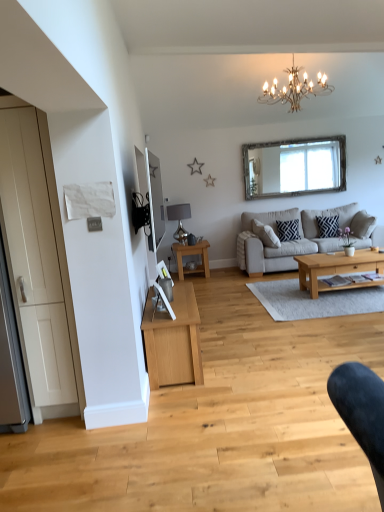
Question: Is there a large distance between matte black mirror at upper left, the first mirror positioned from the left, and silver-framed mirror at upper center, which appears as the second mirror when viewed from the front?

Choices:
 (A) no
 (B) yes

Answer: (B)

Question: Is matte black mirror at upper left, acting as the 2th mirror starting from the right, wider than silver-framed mirror at upper center, positioned as the 1th mirror in top-to-bottom order?

Choices:
 (A) yes
 (B) no

Answer: (B)

Question: Is silver-framed mirror at upper center, marked as the 1th mirror in a back-to-front arrangement, located within matte black mirror at upper left, the 1th mirror ordered from the bottom?

Choices:
 (A) yes
 (B) no

Answer: (B)

Question: From a real-world perspective, is matte black mirror at upper left, the 1th mirror ordered from the bottom, located beneath silver-framed mirror at upper center, the 2th mirror when ordered from bottom to top?

Choices:
 (A) no
 (B) yes

Answer: (B)

Question: Does matte black mirror at upper left, which is the 2th mirror from top to bottom, have a smaller size compared to silver-framed mirror at upper center, the first mirror positioned from the right?

Choices:
 (A) no
 (B) yes

Answer: (B)

Question: Can you confirm if matte black mirror at upper left, which is the 2th mirror in back-to-front order, is thinner than silver-framed mirror at upper center, the first mirror positioned from the right?

Choices:
 (A) no
 (B) yes

Answer: (B)

Question: Is light wood/texture coffee table at center, the 2th coffee table in the right-to-left sequence, to the right of light gray fabric couch at center from the viewer's perspective?

Choices:
 (A) yes
 (B) no

Answer: (B)

Question: Is the surface of light wood/texture coffee table at center, the 2th coffee table when ordered from front to back, in direct contact with light gray fabric couch at center?

Choices:
 (A) yes
 (B) no

Answer: (B)

Question: Is light wood/texture coffee table at center, the 2th coffee table when ordered from front to back, facing away from light gray fabric couch at center?

Choices:
 (A) yes
 (B) no

Answer: (B)

Question: Is light wood/texture coffee table at center, which is counted as the first coffee table, starting from the back, aimed at light gray fabric couch at center?

Choices:
 (A) no
 (B) yes

Answer: (B)

Question: Is light wood/texture coffee table at center, the first coffee table in the left-to-right sequence, taller than light gray fabric couch at center?

Choices:
 (A) yes
 (B) no

Answer: (B)

Question: Is light wood/texture coffee table at center, the 2th coffee table when ordered from front to back, thinner than light gray fabric couch at center?

Choices:
 (A) no
 (B) yes

Answer: (B)

Question: Can you confirm if white matte door at left is smaller than light brown wooden coffee table at center, the 2th coffee table viewed from the left?

Choices:
 (A) yes
 (B) no

Answer: (B)